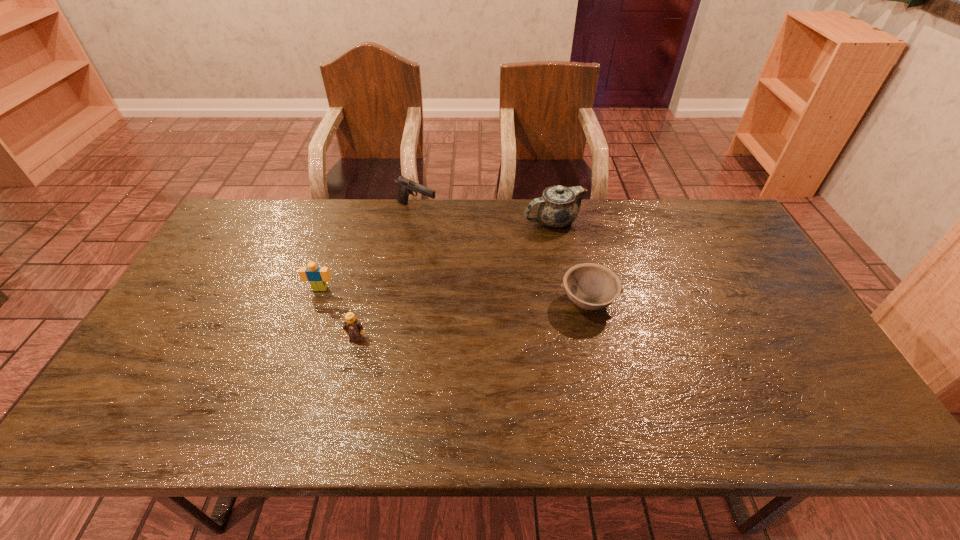
Identify the location of free spot that satisfies the following two spatial constraints: 1. from the spout of the chinaware; 2. on the back side of the shortest object. The height and width of the screenshot is (540, 960). (569, 301).

Find the location of a particular element. vacant area in the image that satisfies the following two spatial constraints: 1. on the face of the leftmost object; 2. on the left side of the shortest object is located at coordinates (316, 301).